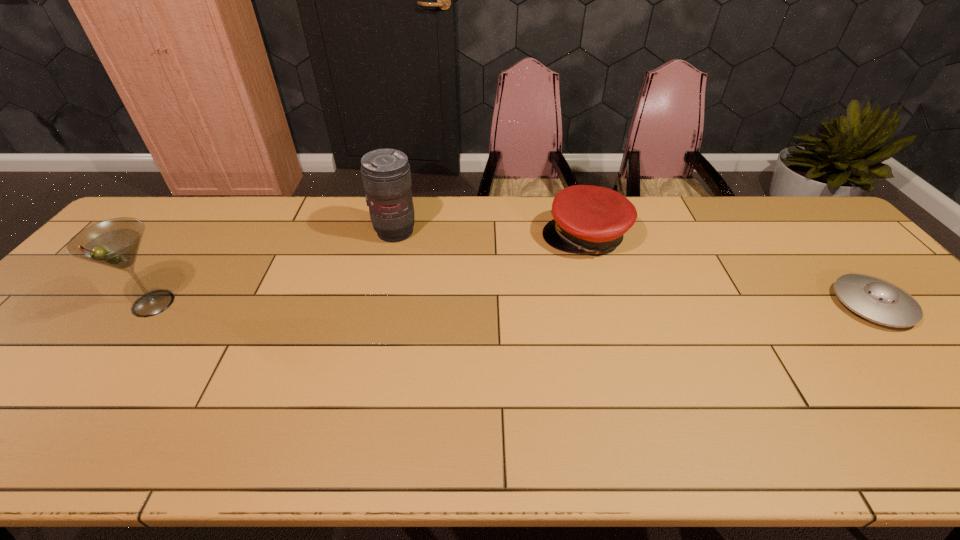
I want to click on free space on the desktop that is between the martini and the saucer and is positioned at the front of the third object from left to right where the visor is located, so click(x=487, y=304).

Identify the location of free space on the desktop that is between the martini and the rightmost object and is positioned on the side of the telephoto lens where the control switches are located. The height and width of the screenshot is (540, 960). (507, 304).